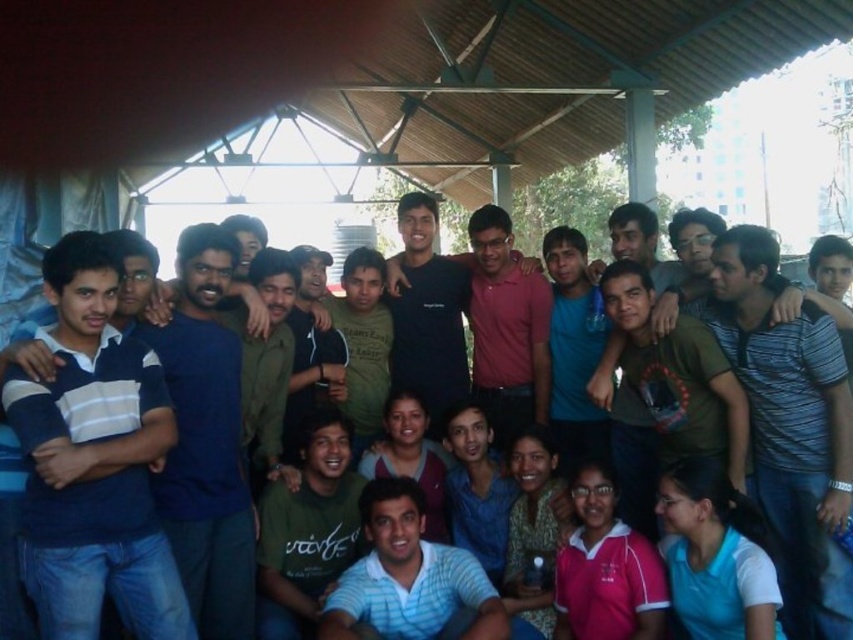
You are taking a photo of the group under the wooden structure and notice two points marked in the image. Which point, point (x=335, y=417) or point (x=480, y=236), is closer to your camera lens?

Point (x=335, y=417) is closer to the camera lens than point (x=480, y=236).